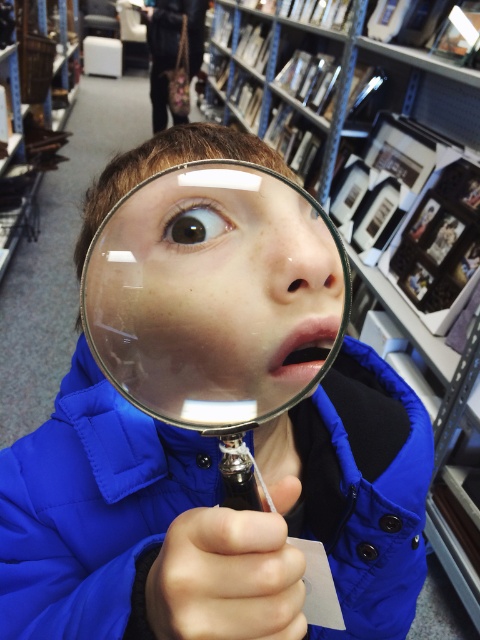
Question: Can you confirm if metallic silver bookshelf at upper center is bigger than black glossy eye at center?

Choices:
 (A) no
 (B) yes

Answer: (B)

Question: Is blue matte jacket at center below transparent glass magnifying glass at center?

Choices:
 (A) yes
 (B) no

Answer: (A)

Question: Which point is closer to the camera?

Choices:
 (A) black glossy eye at center
 (B) blue matte jacket at center

Answer: (B)

Question: Is metallic silver bookshelf at upper center smaller than black glossy eye at center?

Choices:
 (A) yes
 (B) no

Answer: (B)

Question: Which point is farther from the camera taking this photo?

Choices:
 (A) (74, 518)
 (B) (203, 202)
 (C) (322, 346)
 (D) (446, 618)

Answer: (D)

Question: Which object is the closest to the black glossy eye at center?

Choices:
 (A) blue matte jacket at center
 (B) metallic silver bookshelf at upper center

Answer: (A)